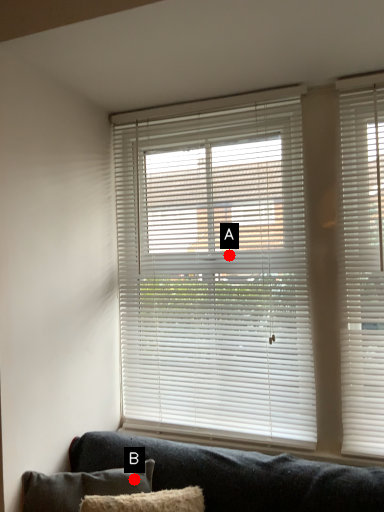
Question: Two points are circled on the image, labeled by A and B beside each circle. Which of the following is the closest to the observer?

Choices:
 (A) A is closer
 (B) B is closer

Answer: (B)